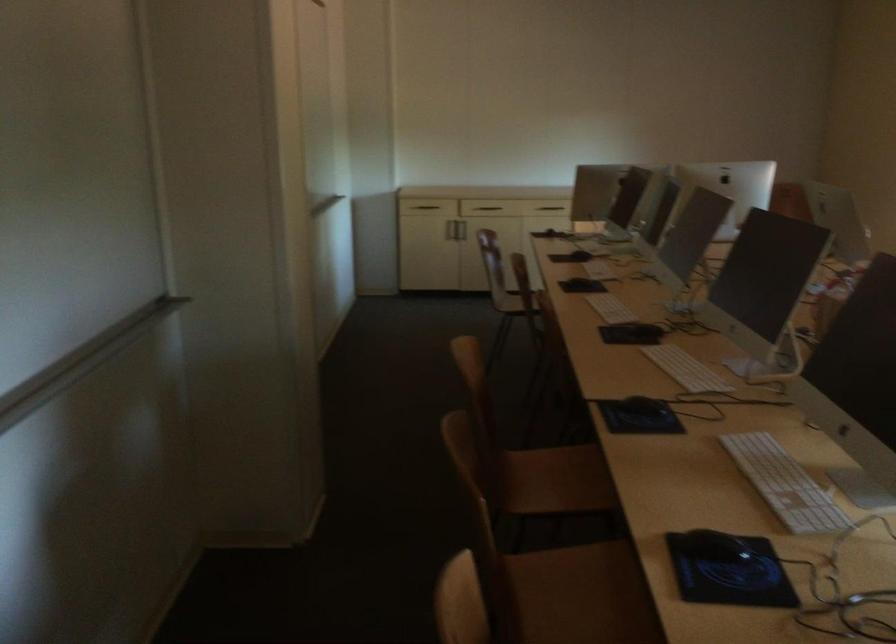
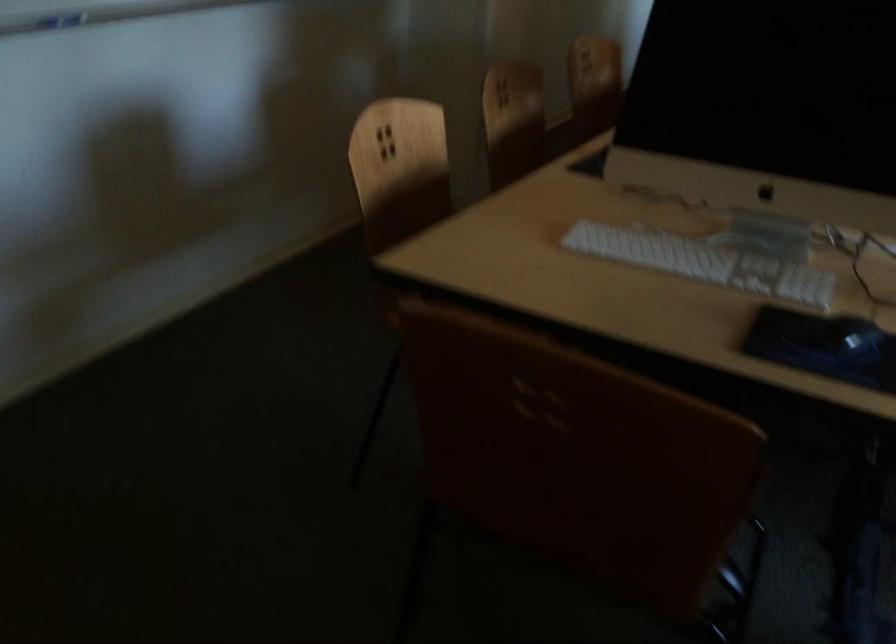
Question: I am providing you with two images of the same scene from different viewpoints. After the viewpoint changes to image2, which objects are now occluded?

Choices:
 (A) black computer mouse
 (B) c
 (C) wooden chair sitting surface
 (D) white keyboard

Answer: (C)